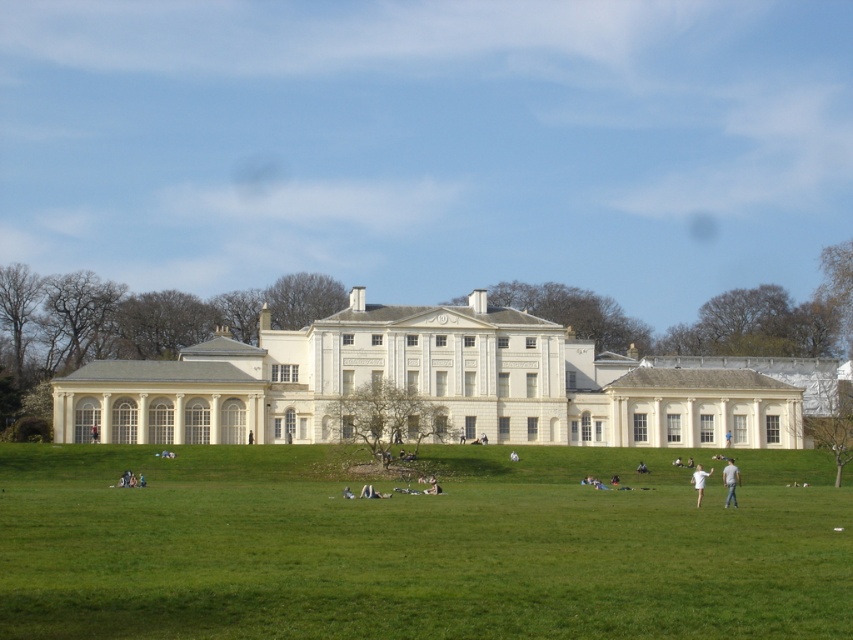
Question: Is green grass at center thinner than light brown leather jacket at lower right?

Choices:
 (A) no
 (B) yes

Answer: (A)

Question: Which point appears closest to the camera in this image?

Choices:
 (A) (589, 561)
 (B) (727, 486)

Answer: (A)

Question: Is green grass at center bigger than light brown leather jacket at lower right?

Choices:
 (A) no
 (B) yes

Answer: (B)

Question: Which point appears farthest from the camera in this image?

Choices:
 (A) (395, 378)
 (B) (297, 557)

Answer: (A)

Question: Considering the real-world distances, which object is closest to the white cotton shirt at lower center?

Choices:
 (A) white smooth mansion at center
 (B) green grass at center
 (C) light brown leather jacket at lower right

Answer: (C)

Question: Does green grass at center appear on the left side of light brown leather jacket at lower right?

Choices:
 (A) yes
 (B) no

Answer: (A)